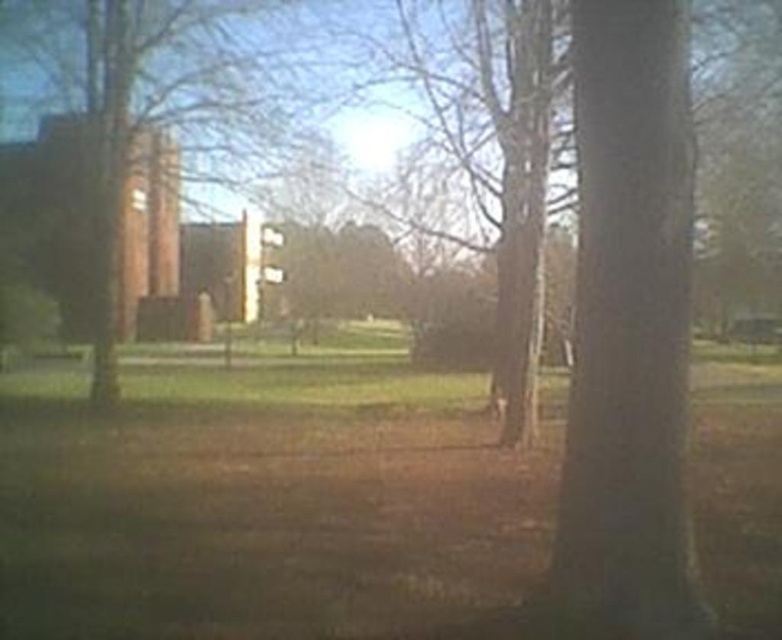
Locate an element on the screen. Image resolution: width=782 pixels, height=640 pixels. green grass at center is located at coordinates point(264,499).

Is point (332, 400) more distant than point (644, 234)?

That is True.

You are a GUI agent. You are given a task and a screenshot of the screen. Output one action in this format:
    pyautogui.click(x=<x>, y=<y>)
    Task: Click on the green grass at center
    This screenshot has height=640, width=782.
    Given the screenshot: What is the action you would take?
    pyautogui.click(x=264, y=499)

Does point (144, 541) come behind point (223, 113)?

That is False.

Can you confirm if green grass at center is wider than brown wood tree at left?

Correct, the width of green grass at center exceeds that of brown wood tree at left.

Between point (268, 554) and point (307, 65), which one is positioned in front?

Point (268, 554) is more forward.

Find the location of a particular element. The image size is (782, 640). green grass at center is located at coordinates (264, 499).

Who is positioned more to the right, smooth bark tree at center or brown wood tree at left?

smooth bark tree at center is more to the right.

Describe the element at coordinates (628, 330) in the screenshot. I see `smooth bark tree at center` at that location.

Describe the element at coordinates (628, 330) in the screenshot. The image size is (782, 640). I see `smooth bark tree at center` at that location.

Identify the location of smooth bark tree at center. This screenshot has height=640, width=782. (628, 330).